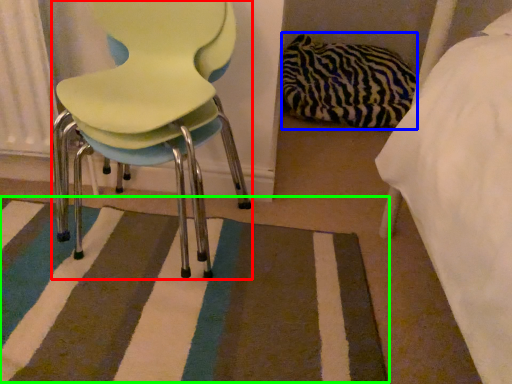
Question: Considering the real-world distances, which object is closest to chair (highlighted by a red box)? material (highlighted by a blue box) or mat (highlighted by a green box).

Choices:
 (A) material
 (B) mat

Answer: (B)